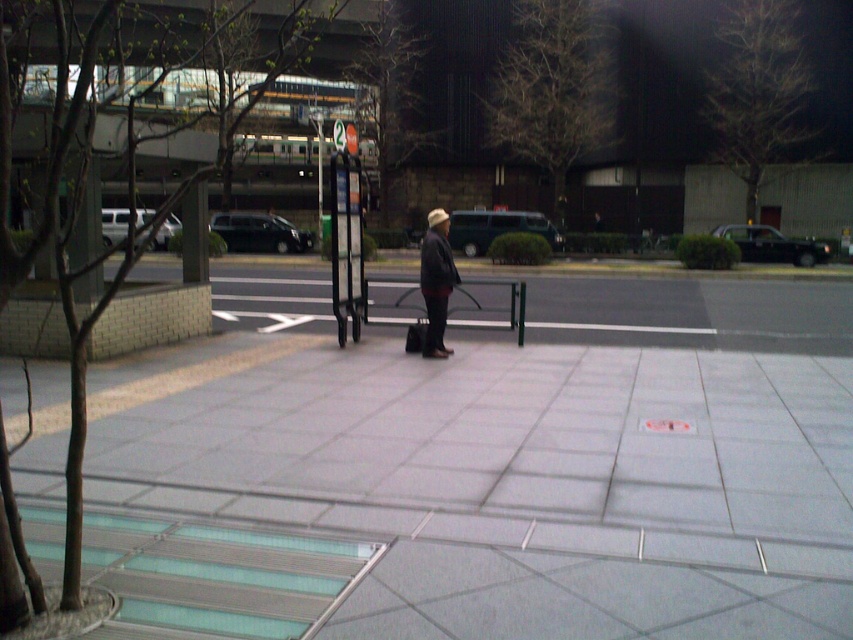
Does gray tile pavement at center have a greater width compared to dark gray fabric jacket at center?

Yes, gray tile pavement at center is wider than dark gray fabric jacket at center.

Is point (813, 596) behind point (439, 273)?

That is False.

Between point (633, 595) and point (453, 268), which one is positioned in front?

Point (633, 595)

The image size is (853, 640). In order to click on gray tile pavement at center in this screenshot , I will do `click(471, 493)`.